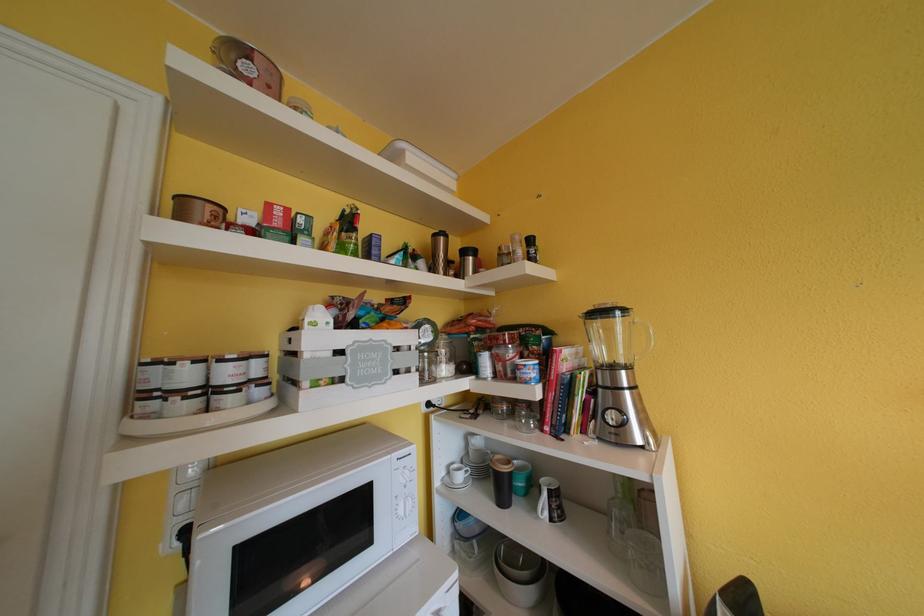
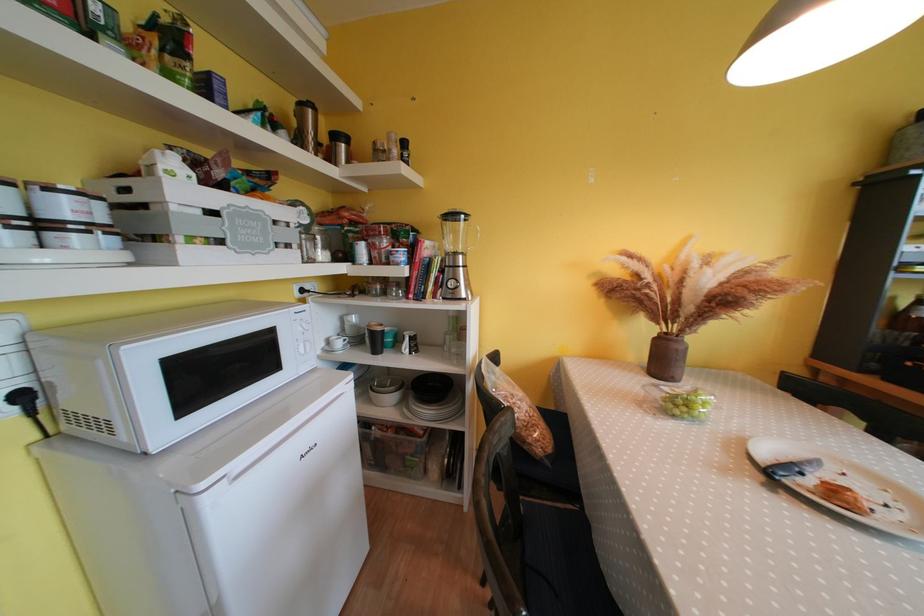
In the second image, find the point that corresponds to the point at 591,408 in the first image.

(444, 282)